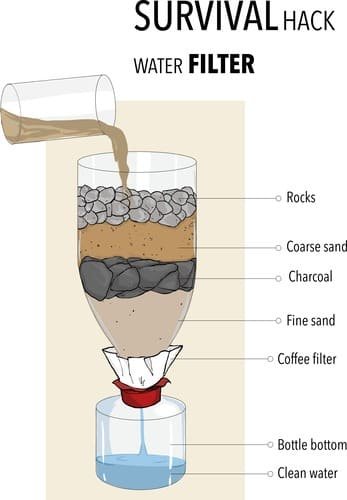
Locate an element on the screen. The height and width of the screenshot is (500, 347). cup is located at coordinates (76, 106).